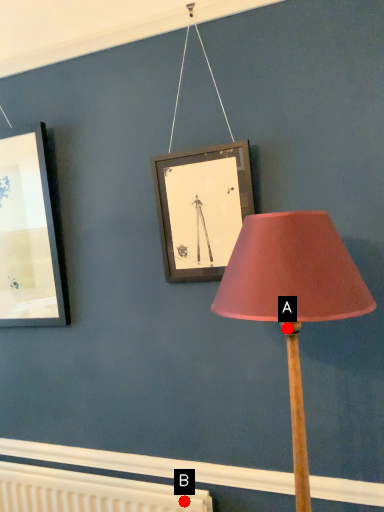
Question: Two points are circled on the image, labeled by A and B beside each circle. Which of the following is the closest to the observer?

Choices:
 (A) A is closer
 (B) B is closer

Answer: (A)